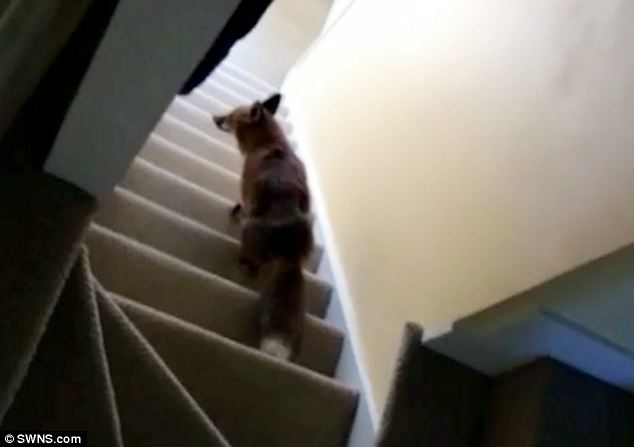
You are a GUI agent. You are given a task and a screenshot of the screen. Output one action in this format:
    pyautogui.click(x=<x>, y=<y>)
    Task: Click on the railing post
    The height and width of the screenshot is (447, 634).
    Given the screenshot: What is the action you would take?
    pyautogui.click(x=89, y=129)